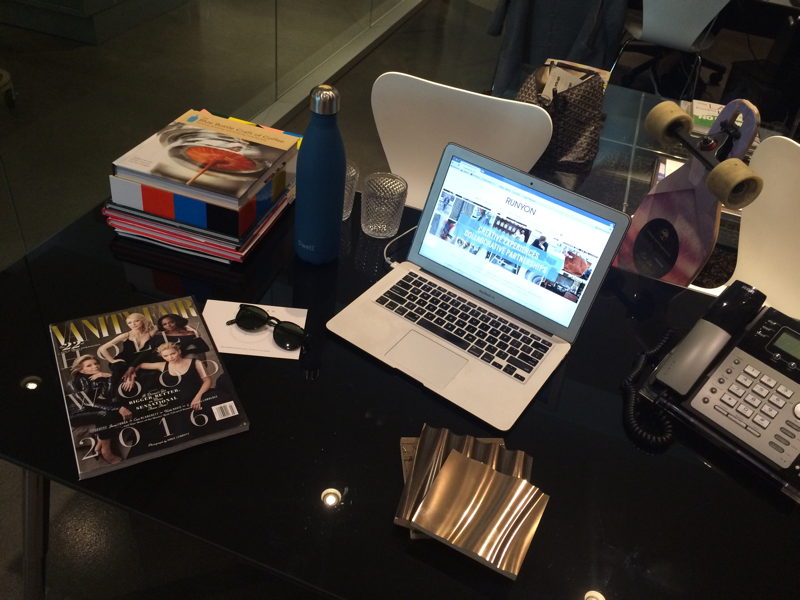
Where is `telephone`? The width and height of the screenshot is (800, 600). telephone is located at coordinates (701, 358).